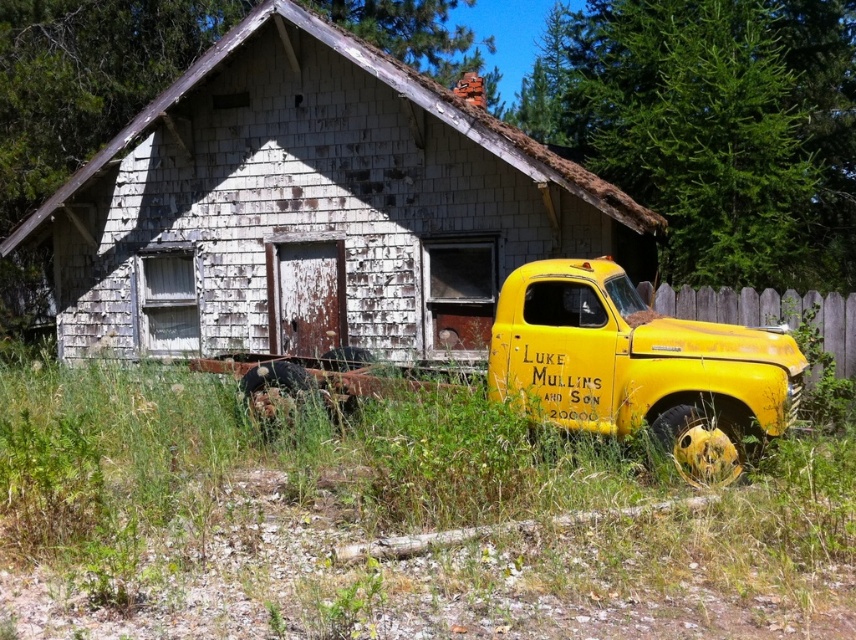
You are a photographer planning to capture the rusty yellow truck at right and the green grass at lower center in a single frame. Based on their heights, which object will appear taller in the photo?

The rusty yellow truck at right will appear taller in the photo because the green grass at lower center has a lesser height compared to it.

You are standing at the lower center of the image and need to walk to the rusty yellow truck at right. What direction should you move in relative to the green grass at lower center?

You should move to the right relative to the green grass at lower center because the rusty yellow truck at right is located to the right of the green grass at lower center.

You are a delivery person who needs to park your 2.5 meter wide delivery van between the green grass at lower center and the rusty yellow truck at right. Is there enough space for your van?

The green grass at lower center is 3.18 meters from the rusty yellow truck at right. Since your delivery van is 2.5 meters wide, there is enough space to park between them as the distance between the two objects is greater than the van width.